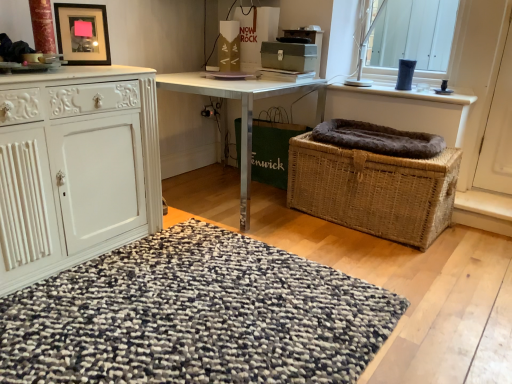
Question: Considering the relative sizes of white carved cabinet at left and woven brown picnic basket at lower right in the image provided, is white carved cabinet at left wider than woven brown picnic basket at lower right?

Choices:
 (A) yes
 (B) no

Answer: (A)

Question: Can you confirm if white carved cabinet at left is bigger than woven brown picnic basket at lower right?

Choices:
 (A) yes
 (B) no

Answer: (A)

Question: From a real-world perspective, is white carved cabinet at left located higher than woven brown picnic basket at lower right?

Choices:
 (A) yes
 (B) no

Answer: (A)

Question: Is white carved cabinet at left far from woven brown picnic basket at lower right?

Choices:
 (A) no
 (B) yes

Answer: (B)

Question: Is woven brown picnic basket at lower right completely or partially inside white carved cabinet at left?

Choices:
 (A) no
 (B) yes

Answer: (A)

Question: From the image's perspective, is white carved cabinet at left under woven brown picnic basket at lower right?

Choices:
 (A) yes
 (B) no

Answer: (B)

Question: Is metallic silver desk at center wider than white carved cabinet at left?

Choices:
 (A) yes
 (B) no

Answer: (A)

Question: Is metallic silver desk at center touching white carved cabinet at left?

Choices:
 (A) no
 (B) yes

Answer: (A)

Question: Does metallic silver desk at center turn towards white carved cabinet at left?

Choices:
 (A) yes
 (B) no

Answer: (A)

Question: Considering the relative sizes of metallic silver desk at center and white carved cabinet at left in the image provided, is metallic silver desk at center bigger than white carved cabinet at left?

Choices:
 (A) yes
 (B) no

Answer: (A)

Question: Considering the relative sizes of metallic silver desk at center and white carved cabinet at left in the image provided, is metallic silver desk at center shorter than white carved cabinet at left?

Choices:
 (A) yes
 (B) no

Answer: (A)

Question: Would you say metallic silver desk at center contains white carved cabinet at left?

Choices:
 (A) yes
 (B) no

Answer: (B)

Question: Is metallic silver desk at center to the left of textured woolen rug at center from the viewer's perspective?

Choices:
 (A) yes
 (B) no

Answer: (B)